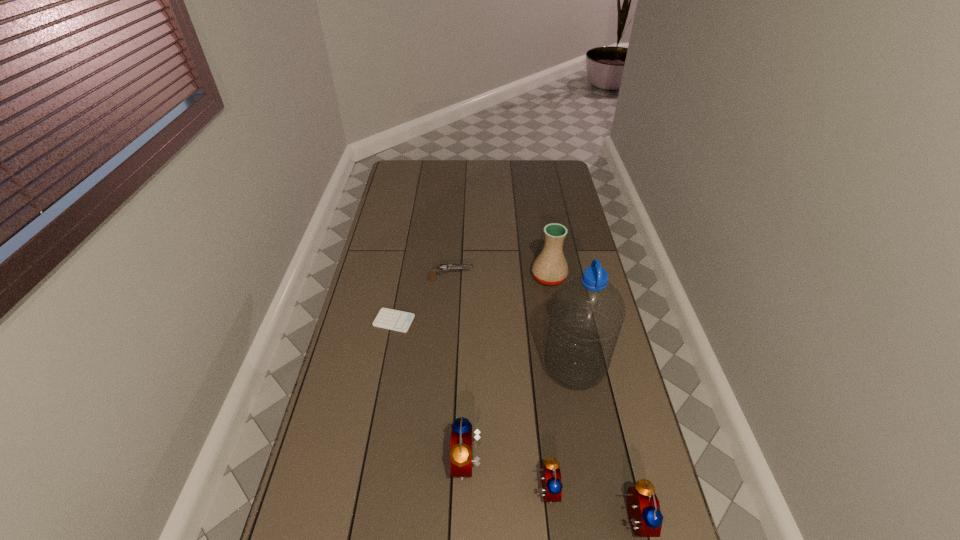
Identify the location of the leftmost alarm clock. (461, 461).

Where is `the third shortest object`? the third shortest object is located at coordinates (552, 485).

Locate an element on the screen. the fourth object from right to left is located at coordinates (552, 485).

Identify the location of pottery. (550, 267).

Where is `the fifth nearest object`? This screenshot has height=540, width=960. the fifth nearest object is located at coordinates (390, 319).

Image resolution: width=960 pixels, height=540 pixels. I want to click on the shortest object, so click(390, 319).

You are a GUI agent. You are given a task and a screenshot of the screen. Output one action in this format:
    pyautogui.click(x=<x>, y=<y>)
    Task: Click on the gun
    The width and height of the screenshot is (960, 540).
    Given the screenshot: What is the action you would take?
    pyautogui.click(x=442, y=267)

Identify the location of water jug. (587, 314).

Where is `the fourth farthest object`? The height and width of the screenshot is (540, 960). the fourth farthest object is located at coordinates (587, 314).

Locate an element on the screen. The height and width of the screenshot is (540, 960). free region located 0.090m on the front-facing side of the leftmost alarm clock is located at coordinates (419, 463).